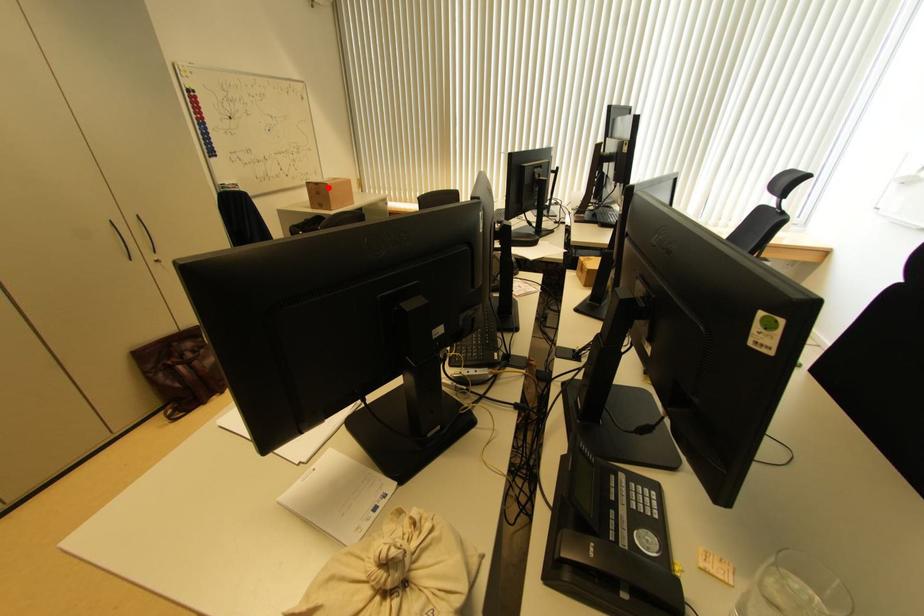
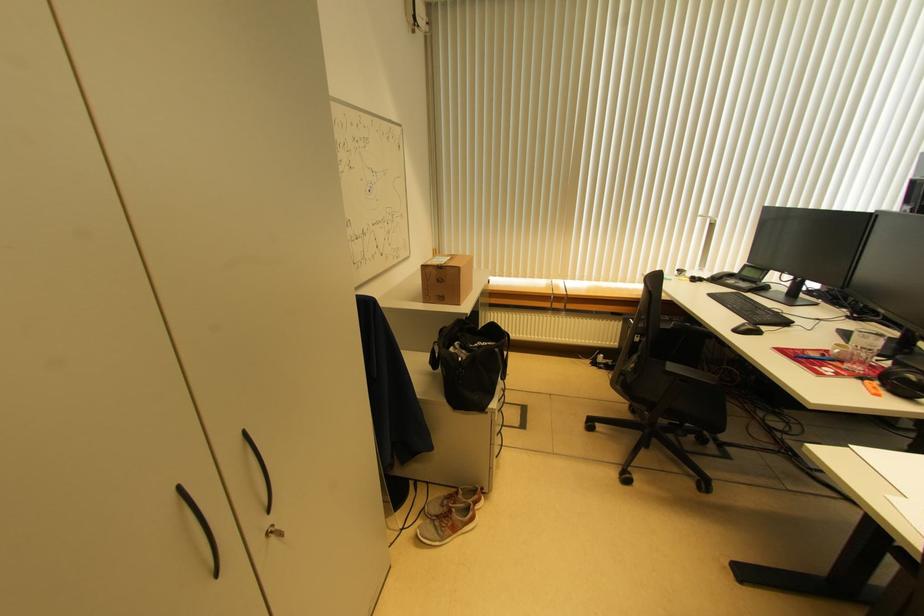
Question: I am providing you with two images of the same scene from different viewpoints. Image1 has a red point marked. In image2, the corresponding 3D location appears at what relative position? Reply with the corresponding letter.

Choices:
 (A) Closer
 (B) Farther

Answer: (B)